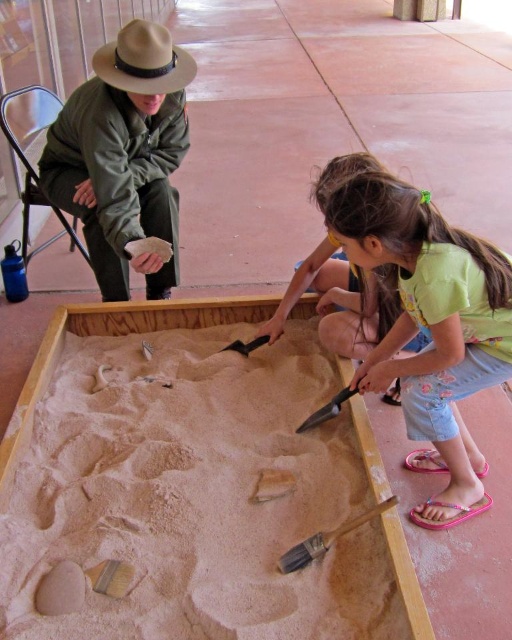
Question: Can you confirm if fine-grained sand at center is smaller than metallic silver shovel at lower center?

Choices:
 (A) no
 (B) yes

Answer: (A)

Question: Which point appears farthest from the camera in this image?

Choices:
 (A) (190, 74)
 (B) (346, 397)

Answer: (A)

Question: Which object is farther from the camera taking this photo?

Choices:
 (A) wooden shovel at center
 (B) green cotton shirt at center
 (C) metallic silver shovel at lower center

Answer: (C)

Question: Is fine-grained sand at center wider than wooden shovel at center?

Choices:
 (A) yes
 (B) no

Answer: (A)

Question: Is beige felt cowboy hat at upper left below wooden shovel at center?

Choices:
 (A) yes
 (B) no

Answer: (B)

Question: Estimate the real-world distances between objects in this image. Which object is farther from the wooden shovel at center?

Choices:
 (A) fine-grained sand at center
 (B) green cotton shirt at center
 (C) metallic silver shovel at lower center

Answer: (B)